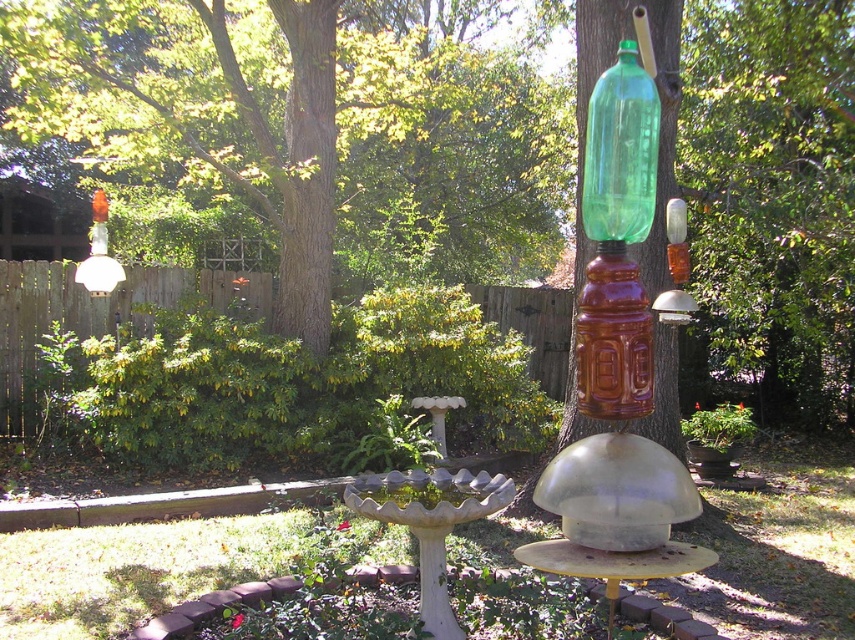
Which is more to the left, green leafy tree at upper left or green glass bottle at upper center?

green leafy tree at upper left is more to the left.

Does green leafy tree at upper left have a greater width compared to green glass bottle at upper center?

Indeed, green leafy tree at upper left has a greater width compared to green glass bottle at upper center.

Measure the distance between green leafy tree at upper left and camera.

The distance of green leafy tree at upper left from camera is 7.01 meters.

Locate an element on the screen. The height and width of the screenshot is (640, 855). green leafy tree at upper left is located at coordinates (314, 129).